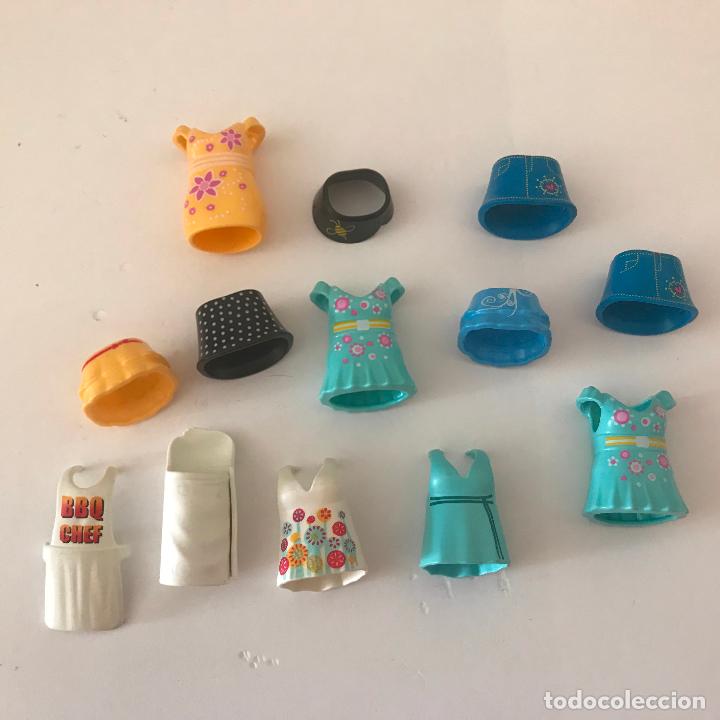
Identify the location of middle row of toy doll clothing. (124, 379), (222, 342), (332, 361), (508, 314), (642, 300).